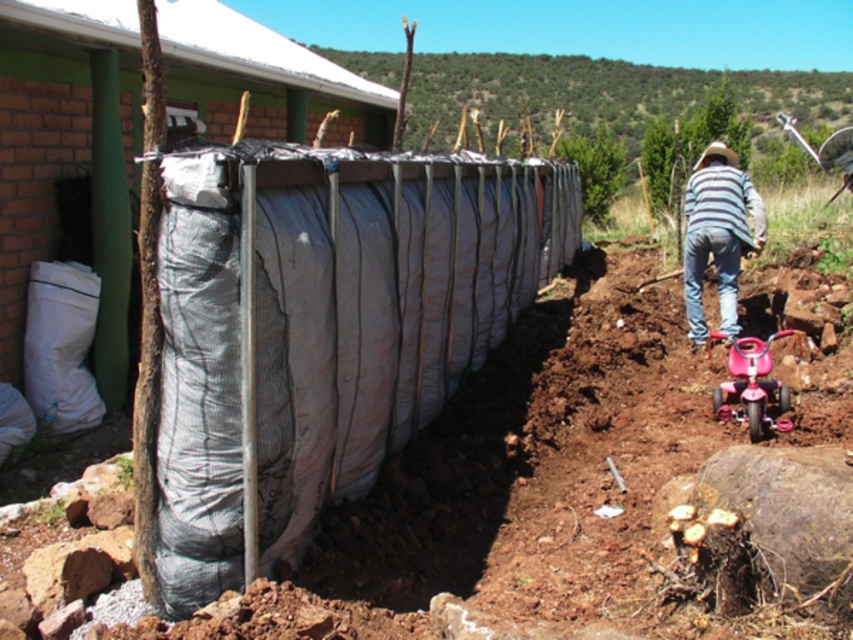
Looking at this image, you are a construction worker on the site. You need to move the striped cotton shirt at right and the pink plastic baby carriage at lower right to a storage area. Which object should you move first to avoid blocking the other?

You should move the pink plastic baby carriage at lower right first because it is behind the striped cotton shirt at right, so moving it first will prevent blocking access to the shirt.

You are a construction worker who needs to move the pink plastic baby carriage at lower right to a safer location away from the retaining wall. Which direction should you move it to ensure it stays to the left of the striped cotton shirt at right?

The striped cotton shirt at right is positioned on the right side of the pink plastic baby carriage at lower right. To keep the pink plastic baby carriage at lower right to the left of the striped cotton shirt at right, you should move it towards the left direction away from the retaining wall.